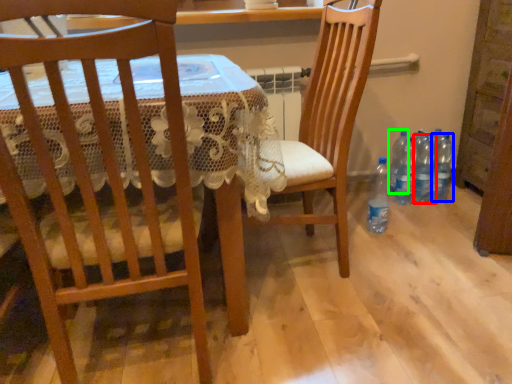
Question: Estimate the real-world distances between objects in this image. Which object is closer to bottle (highlighted by a red box), bottle (highlighted by a blue box) or bottle (highlighted by a green box)?

Choices:
 (A) bottle
 (B) bottle

Answer: (A)